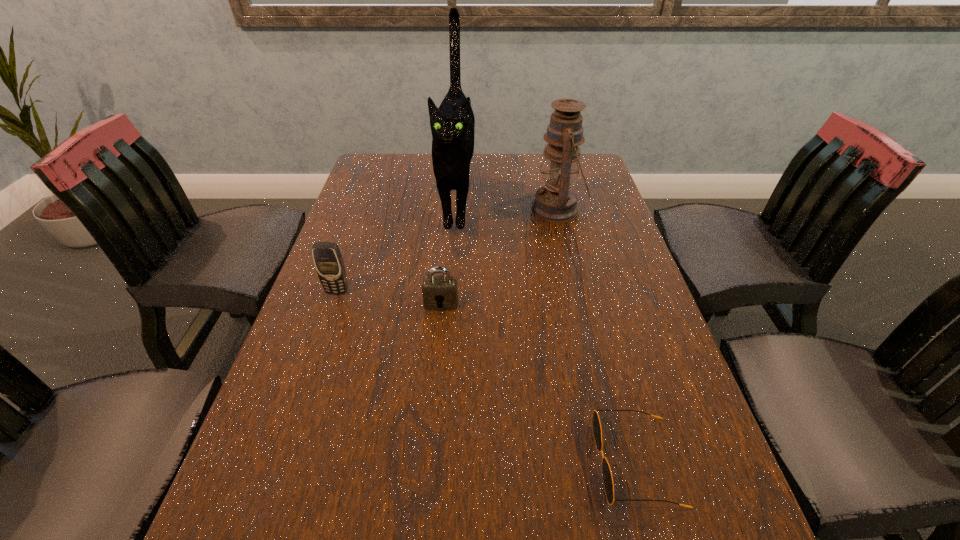
In the image, there is a desktop. Identify the location of vacant area at the left edge. The image size is (960, 540). (322, 535).

Where is `free space at the right edge of the desktop`? This screenshot has height=540, width=960. free space at the right edge of the desktop is located at coordinates (579, 240).

Find the location of `free region at the far left corner of the desktop`. free region at the far left corner of the desktop is located at coordinates (389, 158).

Where is `empty space between the third nearest object and the oil lamp`? Image resolution: width=960 pixels, height=540 pixels. empty space between the third nearest object and the oil lamp is located at coordinates (447, 251).

Image resolution: width=960 pixels, height=540 pixels. What are the coordinates of `empty location between the tallest object and the sunglasses` in the screenshot? It's located at (546, 331).

At what (x,y) coordinates should I click in order to perform the action: click on free spot between the shortest object and the oil lamp. Please return your answer as a coordinate pair (x, y). This screenshot has width=960, height=540. Looking at the image, I should click on (597, 336).

The height and width of the screenshot is (540, 960). I want to click on free space between the cat and the oil lamp, so click(x=507, y=205).

What are the coordinates of `unoccupied position between the third tallest object and the second nearest object` in the screenshot? It's located at (389, 298).

Identify the location of vacant area between the nearest object and the cat. The width and height of the screenshot is (960, 540). (546, 331).

The image size is (960, 540). I want to click on empty location between the second shortest object and the oil lamp, so click(x=499, y=256).